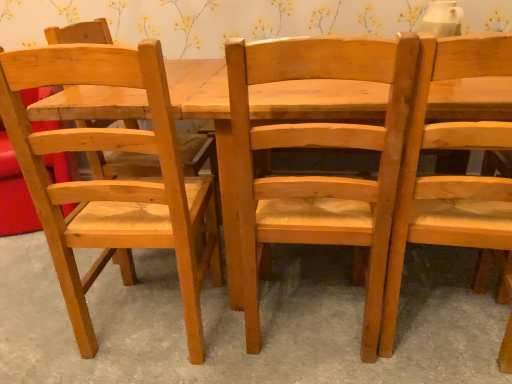
Identify the location of free space that is to the left of natural wood chair at left, placed as the first chair when sorted from left to right. (50, 318).